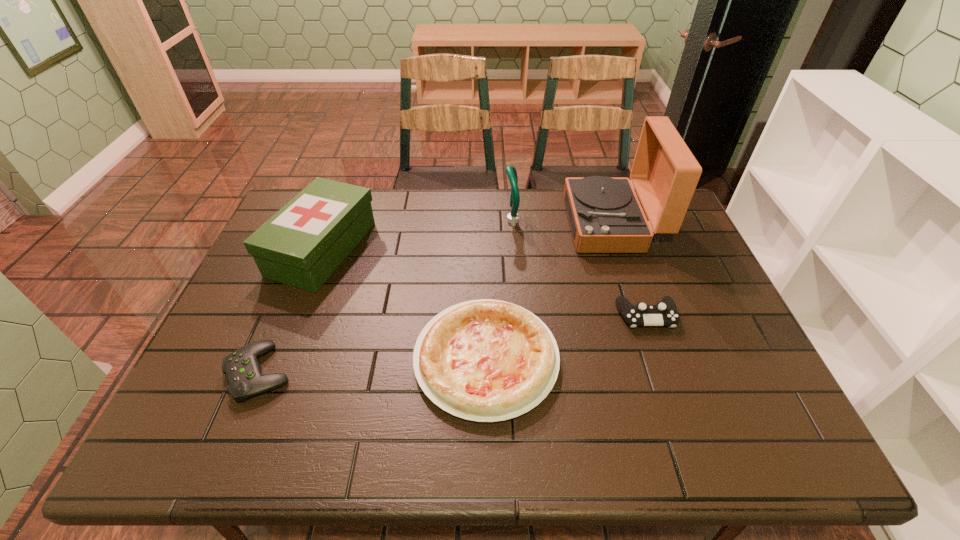
Identify the location of the first-aid kit at the far edge. (301, 245).

Where is `object that is at the near edge`? Image resolution: width=960 pixels, height=540 pixels. object that is at the near edge is located at coordinates (485, 360).

This screenshot has width=960, height=540. What are the coordinates of `the first-aid kit present at the left edge` in the screenshot? It's located at (301, 245).

This screenshot has height=540, width=960. What are the coordinates of `control at the left edge` in the screenshot? It's located at (243, 372).

Locate an element on the screen. The height and width of the screenshot is (540, 960). phonograph record that is at the right edge is located at coordinates coord(605,215).

Identify the location of control present at the right edge. (665, 313).

Image resolution: width=960 pixels, height=540 pixels. I want to click on object that is at the far left corner, so click(x=301, y=245).

The width and height of the screenshot is (960, 540). I want to click on object located at the far right corner, so click(x=605, y=215).

In order to click on free region at the far edge of the desktop in this screenshot , I will do `click(397, 199)`.

The width and height of the screenshot is (960, 540). I want to click on free location at the near edge of the desktop, so click(622, 437).